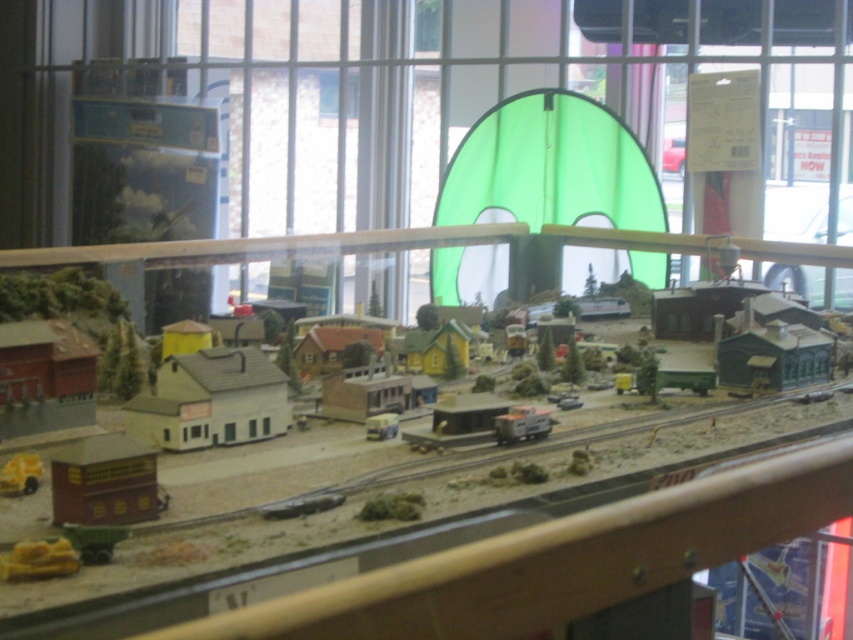
Question: Which object appears farthest from the camera in this image?

Choices:
 (A) wooden grain train car at lower left
 (B) matte red building at left

Answer: (B)

Question: Which of the following is the farthest from the observer?

Choices:
 (A) (492, 420)
 (B) (59, 406)
 (C) (366, 428)
 (D) (74, 458)

Answer: (C)

Question: Can you confirm if yellow matte toy at lower left is positioned to the left of metallic silver train car at center?

Choices:
 (A) no
 (B) yes

Answer: (B)

Question: Does yellow matte toy at lower left appear on the right side of metallic silver trailer at center?

Choices:
 (A) no
 (B) yes

Answer: (A)

Question: Does yellow matte toy at lower left have a lesser width compared to metallic silver train car at center?

Choices:
 (A) no
 (B) yes

Answer: (A)

Question: Which of these objects is positioned farthest from the yellow matte toy at lower left?

Choices:
 (A) metallic silver train car at center
 (B) matte red building at left
 (C) metallic silver trailer at center

Answer: (C)